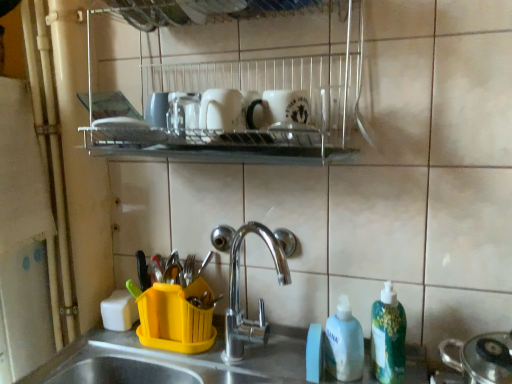
Question: Is green plastic bottle at lower right, which ranks as the first cleaning product in right-to-left order, surrounding metallic silver pot at lower right?

Choices:
 (A) yes
 (B) no

Answer: (B)

Question: Considering the relative sizes of green plastic bottle at lower right, which ranks as the first cleaning product in right-to-left order, and metallic silver pot at lower right in the image provided, is green plastic bottle at lower right, which ranks as the first cleaning product in right-to-left order, smaller than metallic silver pot at lower right?

Choices:
 (A) no
 (B) yes

Answer: (B)

Question: Is green plastic bottle at lower right, which ranks as the first cleaning product in right-to-left order, facing away from metallic silver pot at lower right?

Choices:
 (A) no
 (B) yes

Answer: (A)

Question: From the image's perspective, would you say green plastic bottle at lower right, which ranks as the first cleaning product in right-to-left order, is positioned over metallic silver pot at lower right?

Choices:
 (A) yes
 (B) no

Answer: (A)

Question: Is green plastic bottle at lower right, which ranks as the first cleaning product in right-to-left order, positioned behind metallic silver pot at lower right?

Choices:
 (A) no
 (B) yes

Answer: (B)

Question: In terms of height, does white matte bottle at lower right, which is the second cleaning product from right to left, look taller or shorter compared to metallic silver pot at lower right?

Choices:
 (A) short
 (B) tall

Answer: (B)

Question: Considering the positions of white matte bottle at lower right, which is the second cleaning product from right to left, and metallic silver pot at lower right in the image, is white matte bottle at lower right, which is the second cleaning product from right to left, wider or thinner than metallic silver pot at lower right?

Choices:
 (A) wide
 (B) thin

Answer: (B)

Question: Is white matte bottle at lower right, which is the second cleaning product from right to left, to the left or to the right of metallic silver pot at lower right in the image?

Choices:
 (A) right
 (B) left

Answer: (B)

Question: From the image's perspective, is white matte bottle at lower right, which is the second cleaning product from right to left, above or below metallic silver pot at lower right?

Choices:
 (A) below
 (B) above

Answer: (B)

Question: In the image, is green plastic bottle at lower right, the second cleaning product in the left-to-right sequence, on the left side or the right side of metallic silver pot at lower right?

Choices:
 (A) left
 (B) right

Answer: (A)

Question: From a real-world perspective, is green plastic bottle at lower right, which ranks as the first cleaning product in right-to-left order, positioned above or below metallic silver pot at lower right?

Choices:
 (A) above
 (B) below

Answer: (B)

Question: Does point (388, 324) appear closer or farther from the camera than point (473, 331)?

Choices:
 (A) farther
 (B) closer

Answer: (B)

Question: From the image's perspective, is green plastic bottle at lower right, which ranks as the first cleaning product in right-to-left order, positioned above or below metallic silver pot at lower right?

Choices:
 (A) above
 (B) below

Answer: (A)

Question: From a real-world perspective, is white matte bottle at lower right, arranged as the first cleaning product when viewed from the left, physically located above or below metallic wire rack at upper center?

Choices:
 (A) below
 (B) above

Answer: (A)

Question: Which is correct: white matte bottle at lower right, arranged as the first cleaning product when viewed from the left, is inside metallic wire rack at upper center, or outside of it?

Choices:
 (A) inside
 (B) outside

Answer: (B)